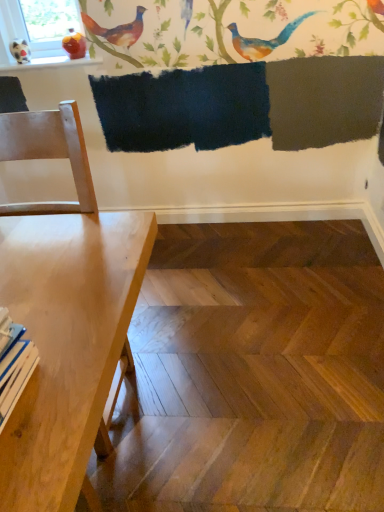
Question: Considering the positions of light wood table at left and white glossy bird at upper left in the image, is light wood table at left wider or thinner than white glossy bird at upper left?

Choices:
 (A) thin
 (B) wide

Answer: (B)

Question: Considering the positions of light wood table at left and white glossy bird at upper left in the image, is light wood table at left taller or shorter than white glossy bird at upper left?

Choices:
 (A) tall
 (B) short

Answer: (A)

Question: Is point (51, 378) closer or farther from the camera than point (14, 55)?

Choices:
 (A) farther
 (B) closer

Answer: (B)

Question: Is white glossy bird at upper left taller or shorter than light wood table at left?

Choices:
 (A) short
 (B) tall

Answer: (A)

Question: In terms of size, does white glossy bird at upper left appear bigger or smaller than light wood table at left?

Choices:
 (A) big
 (B) small

Answer: (B)

Question: Is point (28, 56) positioned closer to the camera than point (48, 403)?

Choices:
 (A) closer
 (B) farther

Answer: (B)

Question: From the image's perspective, relative to light wood table at left, is white glossy bird at upper left above or below?

Choices:
 (A) below
 (B) above

Answer: (B)